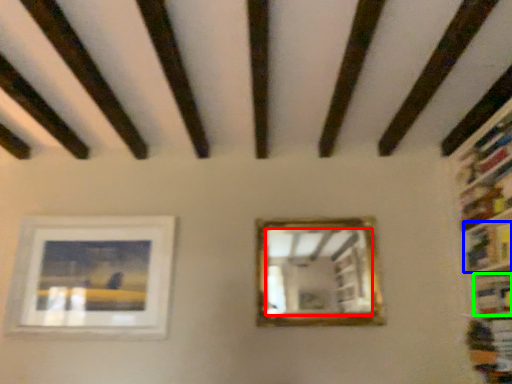
Question: Estimate the real-world distances between objects in this image. Which object is closer to mirror (highlighted by a red box), book (highlighted by a blue box) or book (highlighted by a green box)?

Choices:
 (A) book
 (B) book

Answer: (A)